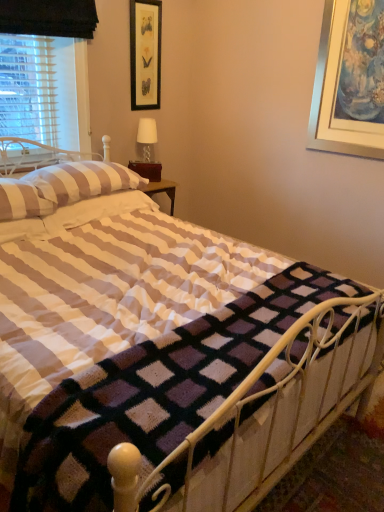
This screenshot has width=384, height=512. What do you see at coordinates (22, 200) in the screenshot?
I see `white striped pillow at upper left, positioned as the 1th pillow in front-to-back order` at bounding box center [22, 200].

Where is `black framed picture at upper center`? This screenshot has height=512, width=384. black framed picture at upper center is located at coordinates (145, 53).

Describe the element at coordinates (82, 181) in the screenshot. I see `white striped pillow at upper left, the first pillow viewed from the back` at that location.

Locate an element on the screen. The image size is (384, 512). white striped pillow at upper left, positioned as the 1th pillow in front-to-back order is located at coordinates (22, 200).

Is white striped fabric at left not within white striped pillow at upper left, positioned as the 1th pillow in front-to-back order?

Indeed, white striped fabric at left is completely outside white striped pillow at upper left, positioned as the 1th pillow in front-to-back order.

Can you confirm if white striped fabric at left is shorter than white striped pillow at upper left, positioned as the 1th pillow in front-to-back order?

In fact, white striped fabric at left may be taller than white striped pillow at upper left, positioned as the 1th pillow in front-to-back order.

Is white striped fabric at left oriented towards white striped pillow at upper left, which is counted as the second pillow, starting from the back?

No, white striped fabric at left is not facing towards white striped pillow at upper left, which is counted as the second pillow, starting from the back.

In the image, is white striped fabric at left on the left side or the right side of white striped pillow at upper left, positioned as the 1th pillow in front-to-back order?

In the image, white striped fabric at left appears on the right side of white striped pillow at upper left, positioned as the 1th pillow in front-to-back order.

Considering the sizes of objects white striped fabric at left and black framed picture at upper center in the image provided, who is bigger, white striped fabric at left or black framed picture at upper center?

With larger size is white striped fabric at left.

Can you tell me how much white striped fabric at left and black framed picture at upper center differ in facing direction?

There is a 1.59-degree angle between the facing directions of white striped fabric at left and black framed picture at upper center.

Is white striped fabric at left in contact with black framed picture at upper center?

No.

Can you confirm if white striped fabric at left is shorter than black framed picture at upper center?

Incorrect, the height of white striped fabric at left does not fall short of that of black framed picture at upper center.

Based on the photo, is white fabric lampshade at upper center bigger or smaller than white striped pillow at upper left, the first pillow viewed from the back?

Clearly, white fabric lampshade at upper center is smaller in size than white striped pillow at upper left, the first pillow viewed from the back.

Between white fabric lampshade at upper center and white striped pillow at upper left, the 2th pillow positioned from the front, which one has more height?

white fabric lampshade at upper center is taller.

Considering the relative positions of white fabric lampshade at upper center and white striped pillow at upper left, the first pillow viewed from the back, in the image provided, is white fabric lampshade at upper center to the left of white striped pillow at upper left, the first pillow viewed from the back, from the viewer's perspective?

No, white fabric lampshade at upper center is not to the left of white striped pillow at upper left, the first pillow viewed from the back.

How different are the orientations of white striped fabric at left and white fabric lampshade at upper center in degrees?

There is a 4.23-degree angle between the facing directions of white striped fabric at left and white fabric lampshade at upper center.

Does point (217, 392) come farther from viewer compared to point (145, 123)?

No, it is in front of (145, 123).

Does white striped fabric at left have a lesser width compared to white fabric lampshade at upper center?

No, white striped fabric at left is not thinner than white fabric lampshade at upper center.

Looking at the image, does white striped fabric at left seem bigger or smaller compared to white fabric lampshade at upper center?

Considering their sizes, white striped fabric at left takes up more space than white fabric lampshade at upper center.

Can you confirm if black framed picture at upper center is shorter than white striped pillow at upper left, positioned as the 1th pillow in front-to-back order?

Incorrect, the height of black framed picture at upper center does not fall short of that of white striped pillow at upper left, positioned as the 1th pillow in front-to-back order.

Looking at this image, can you confirm if black framed picture at upper center is wider than white striped pillow at upper left, positioned as the 1th pillow in front-to-back order?

No, black framed picture at upper center is not wider than white striped pillow at upper left, positioned as the 1th pillow in front-to-back order.

The image size is (384, 512). Find the location of `picture frame behind the white striped pillow at upper left, positioned as the 1th pillow in front-to-back order`. picture frame behind the white striped pillow at upper left, positioned as the 1th pillow in front-to-back order is located at coordinates (145, 53).

Which is more to the right, black framed picture at upper center or white striped pillow at upper left, which is counted as the second pillow, starting from the back?

black framed picture at upper center is more to the right.

Locate an element on the screen. This screenshot has height=512, width=384. table lamp that appears above the white striped pillow at upper left, which is counted as the second pillow, starting from the back (from the image's perspective) is located at coordinates (147, 137).

Between point (146, 122) and point (33, 212), which one is positioned in front?

Positioned in front is point (33, 212).

From the image's perspective, which is above, white fabric lampshade at upper center or white striped pillow at upper left, which is counted as the second pillow, starting from the back?

white fabric lampshade at upper center.

Considering their positions, is white fabric lampshade at upper center located in front of or behind white striped pillow at upper left, positioned as the 1th pillow in front-to-back order?

Visually, white fabric lampshade at upper center is located behind white striped pillow at upper left, positioned as the 1th pillow in front-to-back order.

How different are the orientations of white striped pillow at upper left, the 2th pillow positioned from the front, and white striped pillow at upper left, positioned as the 1th pillow in front-to-back order, in degrees?

There is a 5.08e-05-degree angle between the facing directions of white striped pillow at upper left, the 2th pillow positioned from the front, and white striped pillow at upper left, positioned as the 1th pillow in front-to-back order.

Considering the sizes of objects white striped pillow at upper left, the first pillow viewed from the back, and white striped pillow at upper left, which is counted as the second pillow, starting from the back, in the image provided, who is thinner, white striped pillow at upper left, the first pillow viewed from the back, or white striped pillow at upper left, which is counted as the second pillow, starting from the back,?

white striped pillow at upper left, the first pillow viewed from the back.

Could you tell me if white striped pillow at upper left, the first pillow viewed from the back, is turned towards white striped pillow at upper left, positioned as the 1th pillow in front-to-back order?

No.

In the scene shown: Does white striped pillow at upper left, the first pillow viewed from the back, have a greater height compared to white striped pillow at upper left, which is counted as the second pillow, starting from the back?

Indeed, white striped pillow at upper left, the first pillow viewed from the back, has a greater height compared to white striped pillow at upper left, which is counted as the second pillow, starting from the back.

The width and height of the screenshot is (384, 512). What are the coordinates of `bed on the right of white striped pillow at upper left, positioned as the 1th pillow in front-to-back order` in the screenshot? It's located at (174, 361).

At what (x,y) coordinates should I click in order to perform the action: click on picture frame above the white striped fabric at left (from the image's perspective). Please return your answer as a coordinate pair (x, y). This screenshot has height=512, width=384. Looking at the image, I should click on (145, 53).

From the image, which object appears to be farther from white striped fabric at left, black framed picture at upper center or white striped pillow at upper left, positioned as the 1th pillow in front-to-back order?

black framed picture at upper center lies further to white striped fabric at left than the other object.

Considering their positions, is white striped pillow at upper left, the first pillow viewed from the back, positioned further to white striped fabric at left than black framed picture at upper center?

black framed picture at upper center lies further to white striped fabric at left than the other object.

From the image, which object appears to be farther from white fabric lampshade at upper center, black framed picture at upper center or white striped pillow at upper left, positioned as the 1th pillow in front-to-back order?

Based on the image, white striped pillow at upper left, positioned as the 1th pillow in front-to-back order, appears to be further to white fabric lampshade at upper center.

Estimate the real-world distances between objects in this image. Which object is closer to white striped pillow at upper left, which is counted as the second pillow, starting from the back, white striped fabric at left or white fabric lampshade at upper center?

Based on the image, white striped fabric at left appears to be nearer to white striped pillow at upper left, which is counted as the second pillow, starting from the back.

From the image, which object appears to be nearer to black framed picture at upper center, white striped fabric at left or white fabric lampshade at upper center?

Among the two, white fabric lampshade at upper center is located nearer to black framed picture at upper center.

Based on their spatial positions, is white striped pillow at upper left, positioned as the 1th pillow in front-to-back order, or black framed picture at upper center further from white fabric lampshade at upper center?

white striped pillow at upper left, positioned as the 1th pillow in front-to-back order, is further to white fabric lampshade at upper center.

Looking at the image, which one is located closer to white striped pillow at upper left, positioned as the 1th pillow in front-to-back order, white fabric lampshade at upper center or white striped fabric at left?

white striped fabric at left lies closer to white striped pillow at upper left, positioned as the 1th pillow in front-to-back order, than the other object.

Considering their positions, is white striped pillow at upper left, the first pillow viewed from the back, positioned closer to black framed picture at upper center than white fabric lampshade at upper center?

white fabric lampshade at upper center.

Locate an element on the screen. Image resolution: width=384 pixels, height=512 pixels. pillow between white striped fabric at left and white striped pillow at upper left, the first pillow viewed from the back, along the z-axis is located at coordinates (22, 200).

Locate an element on the screen. pillow between white striped pillow at upper left, which is counted as the second pillow, starting from the back, and white fabric lampshade at upper center, along the z-axis is located at coordinates (82, 181).

I want to click on pillow between black framed picture at upper center and white striped pillow at upper left, positioned as the 1th pillow in front-to-back order, in the up-down direction, so click(x=82, y=181).

Locate an element on the screen. This screenshot has width=384, height=512. table lamp that lies between black framed picture at upper center and white striped pillow at upper left, the first pillow viewed from the back, from top to bottom is located at coordinates (147, 137).